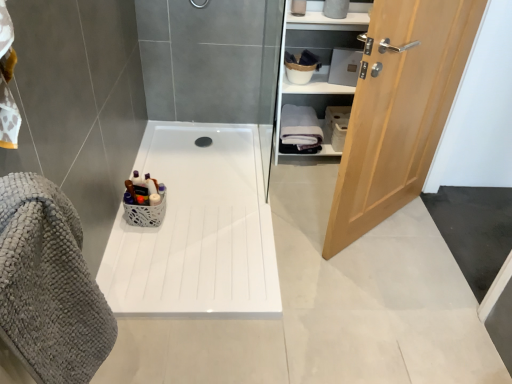
Find the location of `vacant space in front of black rubber drain at center`. vacant space in front of black rubber drain at center is located at coordinates pos(199,150).